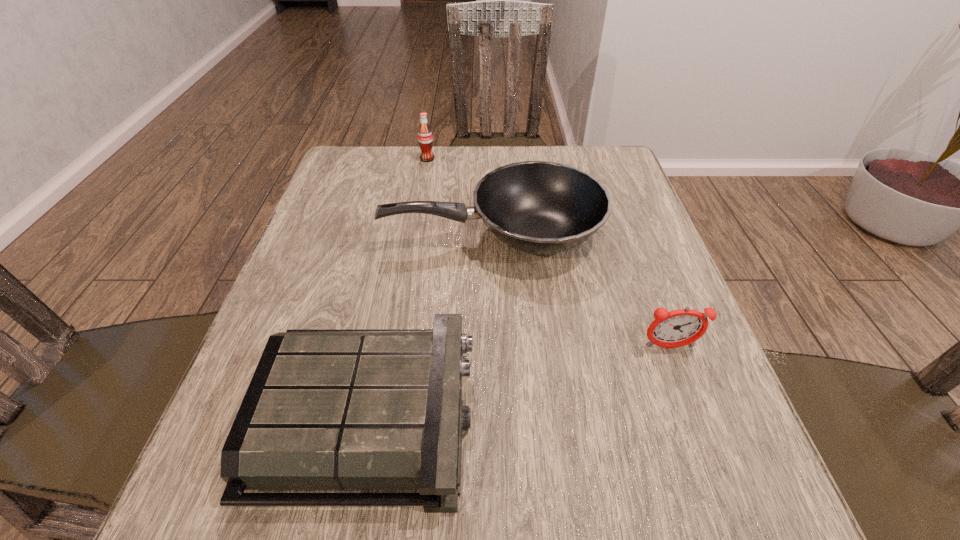
Identify the location of soda. Image resolution: width=960 pixels, height=540 pixels. click(425, 139).

Identify the location of frying pan. (539, 207).

What are the coordinates of `alarm clock` in the screenshot? It's located at (677, 328).

I want to click on radio receiver, so click(x=327, y=409).

Where is `free region located on the right of the farthest object`? The width and height of the screenshot is (960, 540). free region located on the right of the farthest object is located at coordinates (499, 159).

Locate an element on the screen. vacant point located 0.050m on the front of the frying pan is located at coordinates (494, 298).

At what (x,y) coordinates should I click in order to perform the action: click on free location located on the front-facing side of the rightmost object. Please return your answer as a coordinate pair (x, y). Looking at the image, I should click on (686, 394).

Locate an element on the screen. The height and width of the screenshot is (540, 960). vacant space situated on the front panel of the shortest object is located at coordinates (692, 417).

At what (x,y) coordinates should I click in order to perform the action: click on object positioned at the far edge. Please return your answer as a coordinate pair (x, y). This screenshot has height=540, width=960. Looking at the image, I should click on (425, 139).

Locate an element on the screen. object present at the near edge is located at coordinates (327, 409).